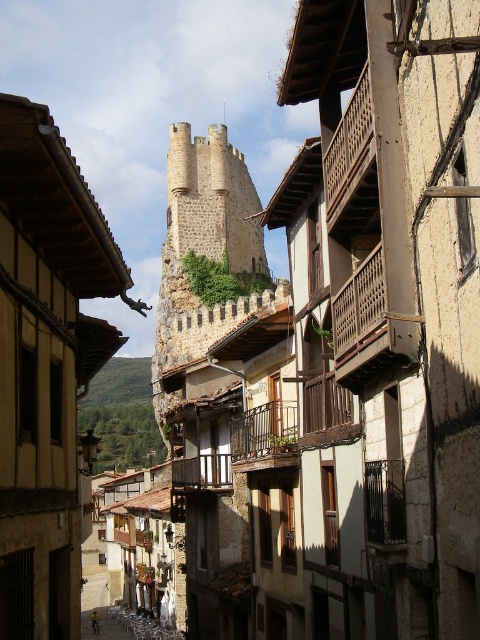
You are a tourist standing at the end of the narrow street and want to take a photo of the stone tower at center and the wooden at upper center. Which object should you focus on first to ensure both are in the frame?

You should focus on the stone tower at center first because it is positioned over the wooden at upper center, so adjusting the camera to include the lower tower will naturally include the upper wooden structure as well.

You are standing on the narrow street looking towards the historic stone tower. You notice two wooden structures in the scene. One is the wooden at upper center and the other is the brown wooden balcony at center. Which of these two wooden structures is closer to you?

The wooden at upper center is closer to the viewer than the brown wooden balcony at center.